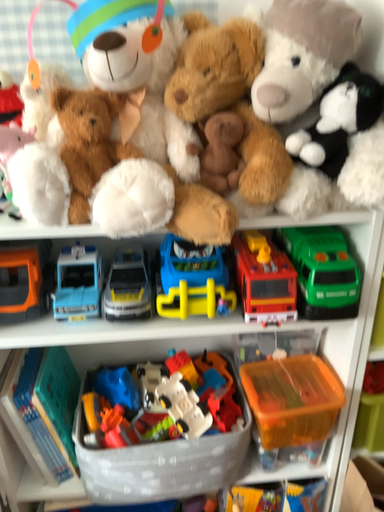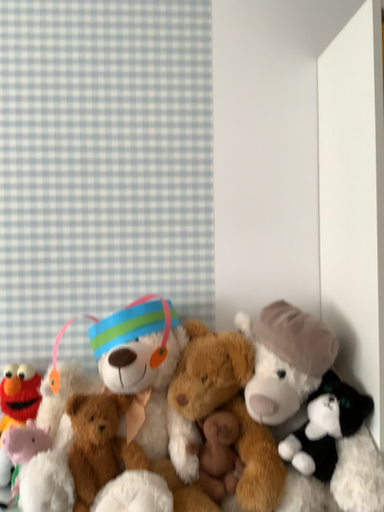
Question: Which way did the camera rotate in the video?

Choices:
 (A) rotated downward
 (B) rotated upward

Answer: (B)